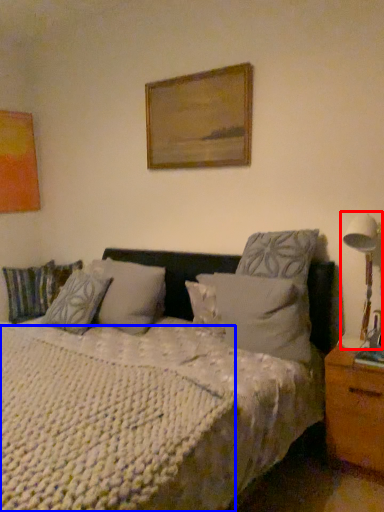
Question: Among these objects, which one is farthest to the camera, table lamp (highlighted by a red box) or mattress (highlighted by a blue box)?

Choices:
 (A) table lamp
 (B) mattress

Answer: (A)